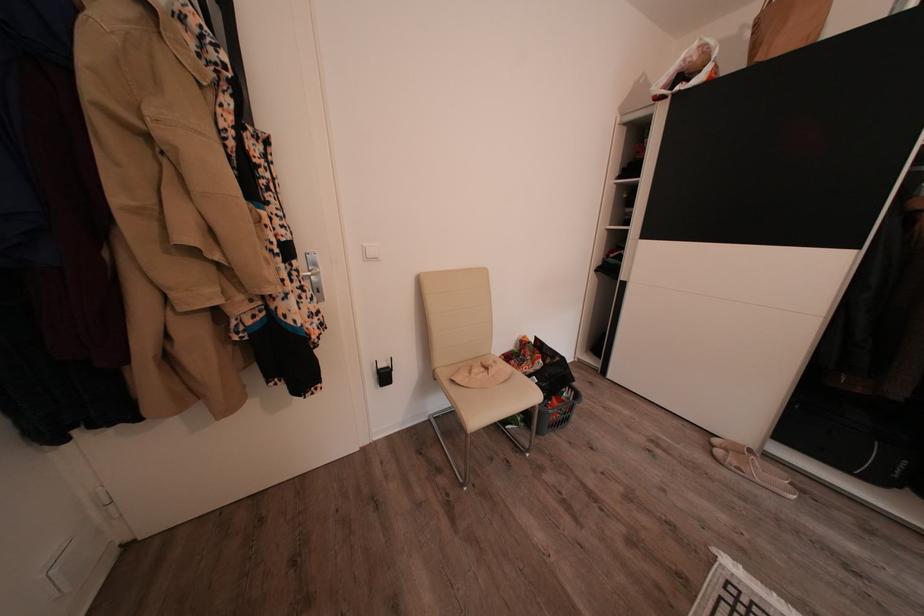
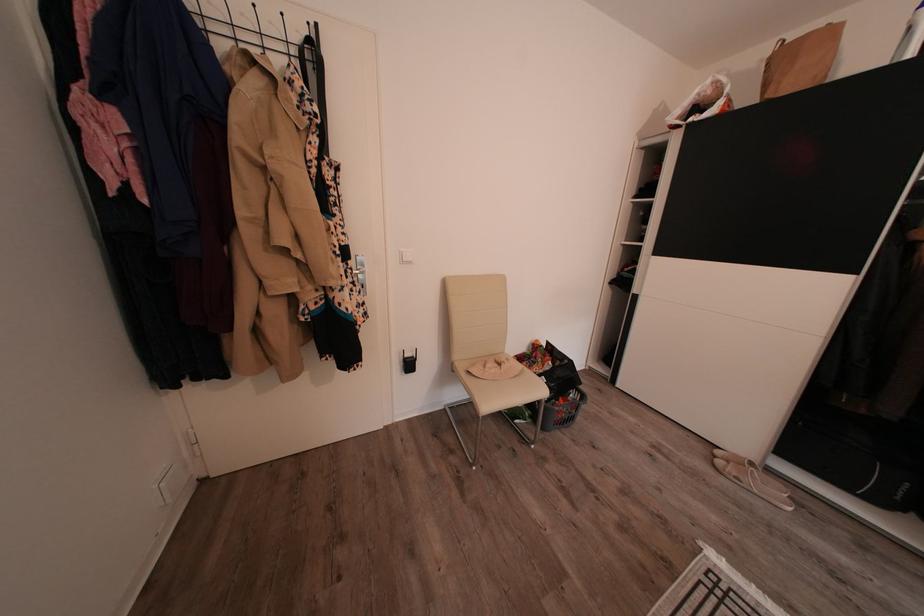
In the second image, find the point that corresponds to [306,276] in the first image.

(359, 274)